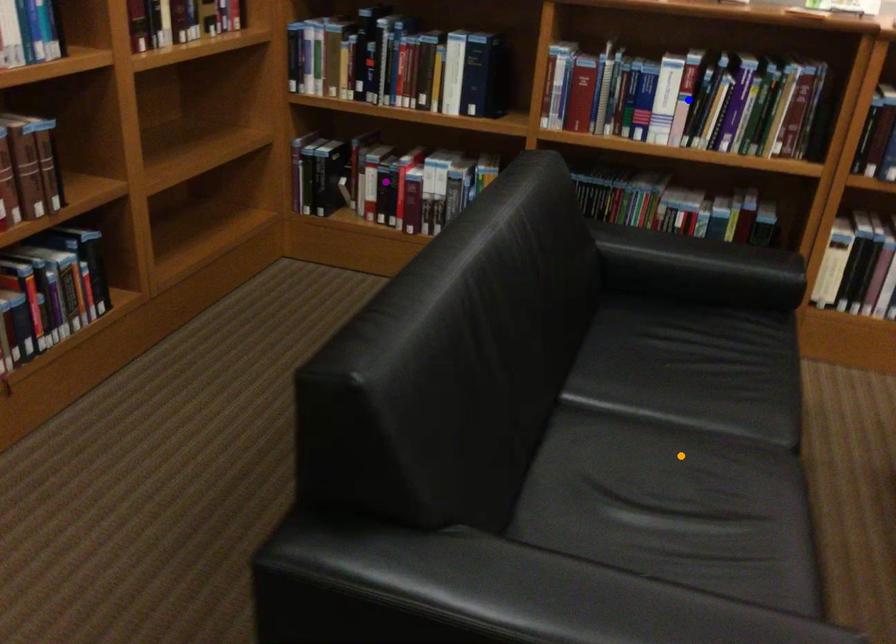
Order these from nearest to farthest:
orange point
blue point
purple point

1. purple point
2. blue point
3. orange point